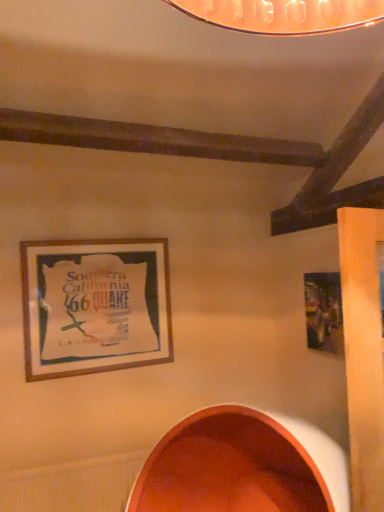
What do you see at coordinates (236, 466) in the screenshot? I see `matte orange bowl at lower center` at bounding box center [236, 466].

Locate an element on the screen. matte orange bowl at lower center is located at coordinates (236, 466).

Which object is wider, wooden frame at upper left, the first picture frame positioned from the left, or metallic silver picture frame at right, acting as the second picture frame starting from the left?

wooden frame at upper left, the first picture frame positioned from the left, is wider.

In the scene shown: Is wooden frame at upper left, placed as the second picture frame when sorted from right to left, beside metallic silver picture frame at right, acting as the second picture frame starting from the left?

No, wooden frame at upper left, placed as the second picture frame when sorted from right to left, is not beside metallic silver picture frame at right, acting as the second picture frame starting from the left.

From a real-world perspective, is wooden frame at upper left, placed as the second picture frame when sorted from right to left, located higher than metallic silver picture frame at right, acting as the second picture frame starting from the left?

Yes, from a real-world perspective, wooden frame at upper left, placed as the second picture frame when sorted from right to left, is above metallic silver picture frame at right, acting as the second picture frame starting from the left.

Does point (31, 372) appear closer or farther from the camera than point (318, 290)?

Point (31, 372) is positioned closer to the camera compared to point (318, 290).

Considering the positions of objects wooden frame at upper left, placed as the second picture frame when sorted from right to left, and matte orange bowl at lower center in the image provided, who is behind, wooden frame at upper left, placed as the second picture frame when sorted from right to left, or matte orange bowl at lower center?

Positioned behind is wooden frame at upper left, placed as the second picture frame when sorted from right to left.

Considering the positions of point (121, 265) and point (263, 420), is point (121, 265) closer or farther from the camera than point (263, 420)?

Point (121, 265) is positioned farther from the camera compared to point (263, 420).

How far apart are wooden frame at upper left, placed as the second picture frame when sorted from right to left, and matte orange bowl at lower center?

30.15 inches.

Considering the points (327, 499) and (99, 292), which point is behind, point (327, 499) or point (99, 292)?

Point (99, 292)

Between matte orange bowl at lower center and wooden frame at upper left, placed as the second picture frame when sorted from right to left, which one is positioned in front?

matte orange bowl at lower center is in front.

Can you confirm if matte orange bowl at lower center is bigger than wooden frame at upper left, the first picture frame positioned from the left?

Yes.

Could you tell me if matte orange bowl at lower center is turned towards wooden frame at upper left, placed as the second picture frame when sorted from right to left?

No, matte orange bowl at lower center does not turn towards wooden frame at upper left, placed as the second picture frame when sorted from right to left.

Who is taller, metallic silver picture frame at right, positioned as the 1th picture frame in right-to-left order, or wooden frame at upper left, placed as the second picture frame when sorted from right to left?

wooden frame at upper left, placed as the second picture frame when sorted from right to left.

Looking at this image, is metallic silver picture frame at right, acting as the second picture frame starting from the left, smaller than wooden frame at upper left, the first picture frame positioned from the left?

Indeed, metallic silver picture frame at right, acting as the second picture frame starting from the left, has a smaller size compared to wooden frame at upper left, the first picture frame positioned from the left.

Looking at this image, is metallic silver picture frame at right, positioned as the 1th picture frame in right-to-left order, turned away from wooden frame at upper left, placed as the second picture frame when sorted from right to left?

No, metallic silver picture frame at right, positioned as the 1th picture frame in right-to-left order, is not facing the opposite direction of wooden frame at upper left, placed as the second picture frame when sorted from right to left.

From the image's perspective, would you say metallic silver picture frame at right, acting as the second picture frame starting from the left, is shown under wooden frame at upper left, the first picture frame positioned from the left?

Yes.

From the image's perspective, does metallic silver picture frame at right, positioned as the 1th picture frame in right-to-left order, appear lower than matte orange bowl at lower center?

Incorrect, from the image's perspective, metallic silver picture frame at right, positioned as the 1th picture frame in right-to-left order, is higher than matte orange bowl at lower center.

Can you confirm if metallic silver picture frame at right, acting as the second picture frame starting from the left, is bigger than matte orange bowl at lower center?

No.

Starting from the matte orange bowl at lower center, which picture frame is the 1st one behind? Please provide its 2D coordinates.

[(324, 312)]

Would you say matte orange bowl at lower center contains metallic silver picture frame at right, acting as the second picture frame starting from the left?

No, metallic silver picture frame at right, acting as the second picture frame starting from the left, is not surrounded by matte orange bowl at lower center.

Does matte orange bowl at lower center have a greater width compared to metallic silver picture frame at right, acting as the second picture frame starting from the left?

Indeed, matte orange bowl at lower center has a greater width compared to metallic silver picture frame at right, acting as the second picture frame starting from the left.

Image resolution: width=384 pixels, height=512 pixels. What are the coordinates of `oval to the left of metallic silver picture frame at right, acting as the second picture frame starting from the left` in the screenshot? It's located at (236, 466).

Considering the relative positions of matte orange bowl at lower center and metallic silver picture frame at right, positioned as the 1th picture frame in right-to-left order, in the image provided, is matte orange bowl at lower center behind metallic silver picture frame at right, positioned as the 1th picture frame in right-to-left order,?

That is False.

Find the location of a particular element. This screenshot has width=384, height=512. picture frame that appears behind the metallic silver picture frame at right, acting as the second picture frame starting from the left is located at coordinates (94, 306).

At what (x,y) coordinates should I click in order to perform the action: click on picture frame on the left of matte orange bowl at lower center. Please return your answer as a coordinate pair (x, y). Looking at the image, I should click on (94, 306).

Estimate the real-world distances between objects in this image. Which object is closer to metallic silver picture frame at right, acting as the second picture frame starting from the left, wooden frame at upper left, placed as the second picture frame when sorted from right to left, or matte orange bowl at lower center?

matte orange bowl at lower center.

When comparing their distances from matte orange bowl at lower center, does metallic silver picture frame at right, acting as the second picture frame starting from the left, or wooden frame at upper left, placed as the second picture frame when sorted from right to left, seem further?

Among the two, wooden frame at upper left, placed as the second picture frame when sorted from right to left, is located further to matte orange bowl at lower center.

From the image, which object appears to be nearer to metallic silver picture frame at right, acting as the second picture frame starting from the left, matte orange bowl at lower center or wooden frame at upper left, the first picture frame positioned from the left?

Among the two, matte orange bowl at lower center is located nearer to metallic silver picture frame at right, acting as the second picture frame starting from the left.

Considering their positions, is wooden frame at upper left, the first picture frame positioned from the left, positioned closer to matte orange bowl at lower center than metallic silver picture frame at right, acting as the second picture frame starting from the left?

metallic silver picture frame at right, acting as the second picture frame starting from the left, is positioned closer to the anchor matte orange bowl at lower center.

Based on their spatial positions, is matte orange bowl at lower center or metallic silver picture frame at right, positioned as the 1th picture frame in right-to-left order, further from wooden frame at upper left, placed as the second picture frame when sorted from right to left?

metallic silver picture frame at right, positioned as the 1th picture frame in right-to-left order.

When comparing their distances from wooden frame at upper left, placed as the second picture frame when sorted from right to left, does metallic silver picture frame at right, positioned as the 1th picture frame in right-to-left order, or matte orange bowl at lower center seem closer?

The object closer to wooden frame at upper left, placed as the second picture frame when sorted from right to left, is matte orange bowl at lower center.

Find the location of a particular element. The width and height of the screenshot is (384, 512). oval between wooden frame at upper left, the first picture frame positioned from the left, and metallic silver picture frame at right, acting as the second picture frame starting from the left, in the horizontal direction is located at coordinates (236, 466).